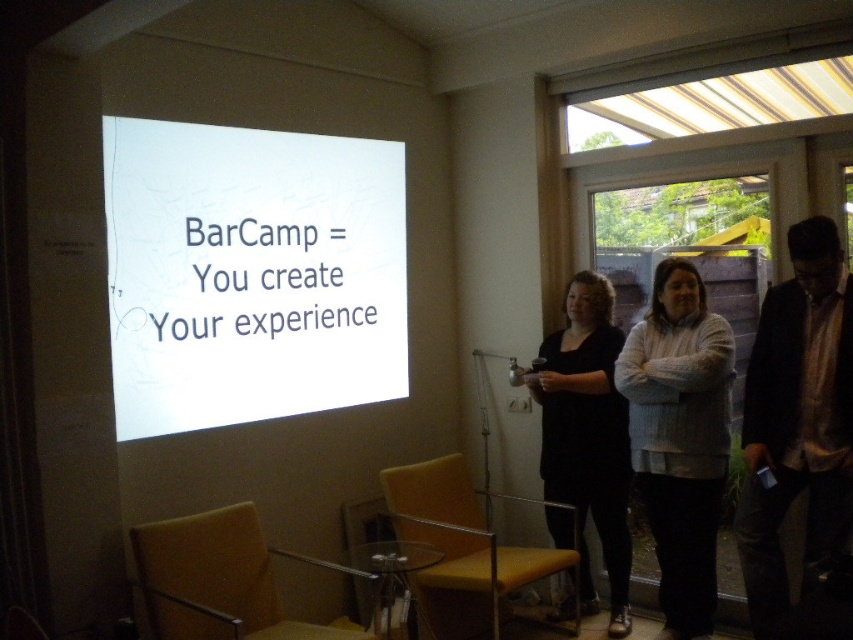
Is white paper at upper center to the right of matte black dress at center from the viewer's perspective?

In fact, white paper at upper center is to the left of matte black dress at center.

Can you confirm if white paper at upper center is smaller than matte black dress at center?

No, white paper at upper center is not smaller than matte black dress at center.

Is point (165, 435) closer to camera compared to point (585, 493)?

Yes, point (165, 435) is closer to viewer.

Where is `white paper at upper center`? The width and height of the screenshot is (853, 640). white paper at upper center is located at coordinates click(x=250, y=273).

Who is lower down, white knitted sweater at center or matte black dress at center?

matte black dress at center is below.

Does white knitted sweater at center have a lesser height compared to matte black dress at center?

Correct, white knitted sweater at center is not as tall as matte black dress at center.

Describe the element at coordinates (680, 436) in the screenshot. I see `white knitted sweater at center` at that location.

Find the location of `white knitted sweater at center`. white knitted sweater at center is located at coordinates (680, 436).

The image size is (853, 640). What do you see at coordinates (680, 436) in the screenshot? I see `white knitted sweater at center` at bounding box center [680, 436].

Can you confirm if white knitted sweater at center is smaller than matte yellow armchair at lower left?

Yes, white knitted sweater at center is smaller than matte yellow armchair at lower left.

Between point (674, 624) and point (201, 576), which one is positioned in front?

Point (201, 576)

Locate an element on the screen. The height and width of the screenshot is (640, 853). white knitted sweater at center is located at coordinates (680, 436).